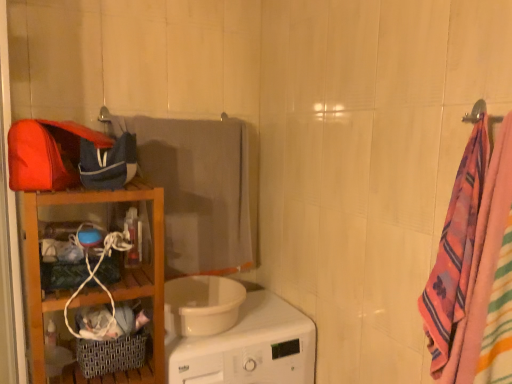
You are a GUI agent. You are given a task and a screenshot of the screen. Output one action in this format:
    pyautogui.click(x=<x>, y=<y>)
    Task: Click on the vacant point above white glossy washing machine at center (from a real-world perspective)
    The image size is (512, 384).
    Given the screenshot: What is the action you would take?
    pyautogui.click(x=256, y=322)